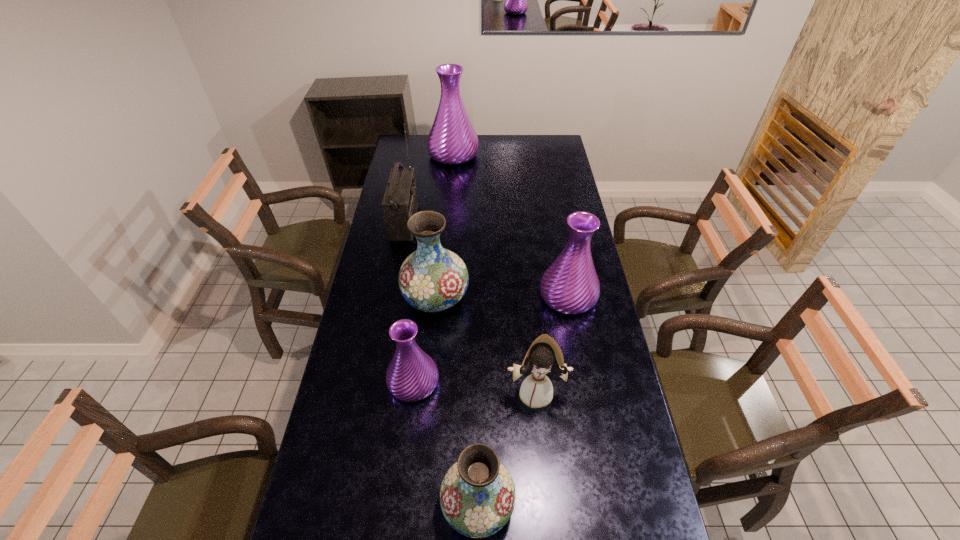
At what (x,y) coordinates should I click in order to perform the action: click on vase that stands as the second closest to the smaller blue vase. Please return your answer as a coordinate pair (x, y). The height and width of the screenshot is (540, 960). Looking at the image, I should click on (431, 279).

You are a GUI agent. You are given a task and a screenshot of the screen. Output one action in this format:
    pyautogui.click(x=<x>, y=<y>)
    Task: Click on the vase identified as the third closest to the smallest purple vase
    The height and width of the screenshot is (540, 960).
    Given the screenshot: What is the action you would take?
    pyautogui.click(x=570, y=285)

Locate an element on the screen. Image resolution: width=960 pixels, height=540 pixels. purple vase that can be found as the closest to the biggest purple vase is located at coordinates (570, 285).

Identify which purple vase is the closest to the fourth farthest vase. Please provide its 2D coordinates. Your answer should be formatted as a tuple, i.e. [(x, y)], where the tuple contains the x and y coordinates of a point satisfying the conditions above.

[(570, 285)]

The width and height of the screenshot is (960, 540). Identify the location of free space that satisfies the following two spatial constraints: 1. on the back side of the bigger blue vase; 2. on the left side of the second biggest purple vase. (436, 296).